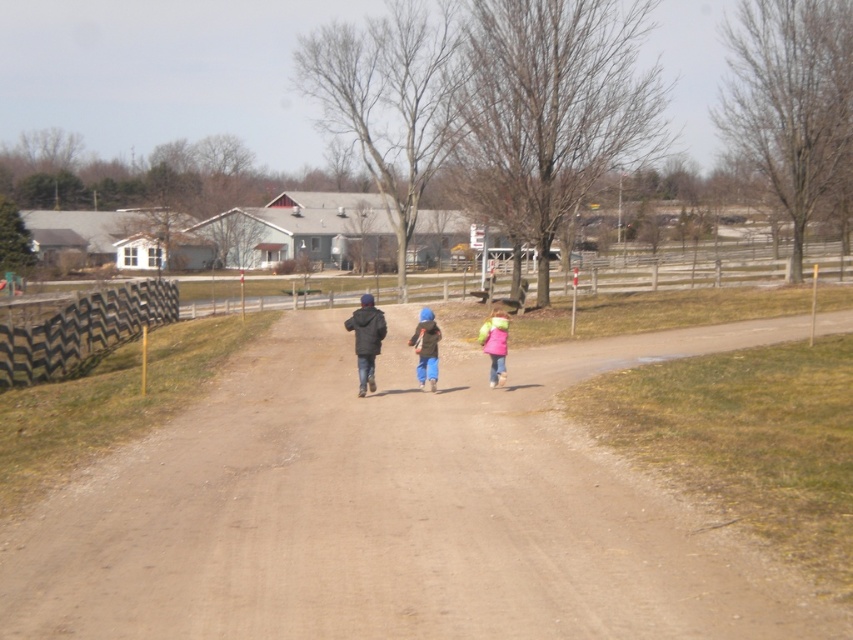
Is point (433, 340) behind point (482, 349)?

No.

Can you confirm if blue denim pants at center is thinner than pink fleece jacket at center?

Indeed, blue denim pants at center has a lesser width compared to pink fleece jacket at center.

Is point (434, 355) positioned after point (491, 369)?

No, it is in front of (491, 369).

At what (x,y) coordinates should I click in order to perform the action: click on blue denim pants at center. Please return your answer as a coordinate pair (x, y). This screenshot has height=640, width=853. Looking at the image, I should click on (426, 348).

The image size is (853, 640). I want to click on brown dirt track at center, so click(x=395, y=512).

Is brown dirt track at center shorter than blue denim pants at center?

In fact, brown dirt track at center may be taller than blue denim pants at center.

Between point (596, 499) and point (421, 328), which one is positioned in front?

Point (596, 499) is more forward.

Locate an element on the screen. brown dirt track at center is located at coordinates (395, 512).

Does point (322, 484) come farther from viewer compared to point (489, 337)?

No, it is not.

Does point (222, 500) lie in front of point (486, 340)?

Yes, point (222, 500) is in front of point (486, 340).

Where is `brown dirt track at center`? This screenshot has height=640, width=853. brown dirt track at center is located at coordinates (395, 512).